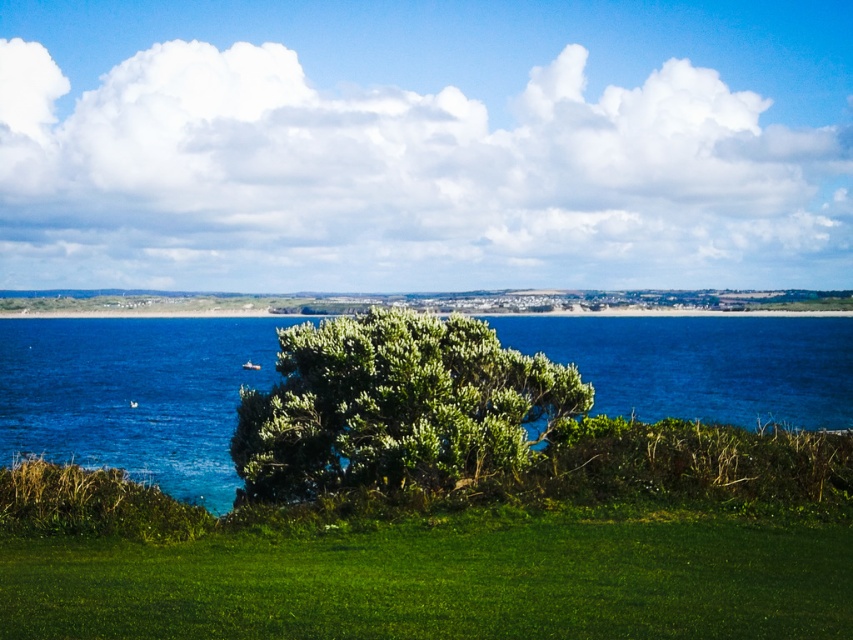
You are standing at the edge of the green grassy area and want to reach the blue water at center. Which direction should you walk to get there from the green grassy at lower center?

Since the green grassy at lower center is to the left of the blue water at center, you should walk to the right to reach the blue water at center from the green grassy at lower center.